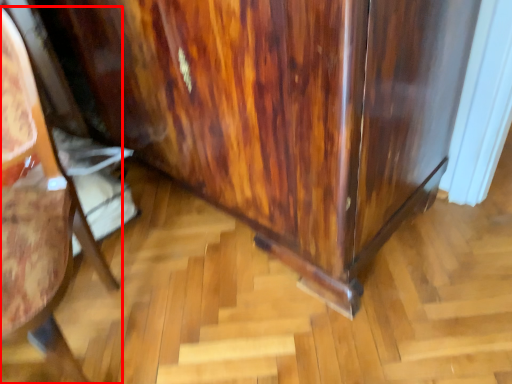
Question: Considering the relative positions of furniture (annotated by the red box) and dresser in the image provided, where is furniture (annotated by the red box) located with respect to the staircase?

Choices:
 (A) right
 (B) left

Answer: (B)